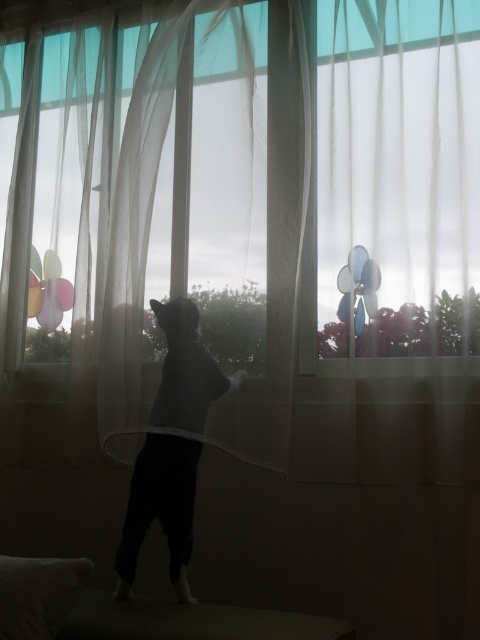
You are a small toy that is 10 cm tall. You are placed on the dark brown wooden stool at lower center and want to roll down to the floor. Will you pass by the silhouette fur at center on your way down?

The dark brown wooden stool at lower center is in front of the silhouette fur at center, meaning the silhouette fur at center is behind the stool. Since the toy is on the stool and rolls down, it will not pass by the silhouette fur at center as it goes to the floor.

You are a photographer setting up a camera in this scene. You want to focus on the point that is closer to the camera. Which point should you choose between point (189, 529) and point (31, 570)?

Point (31, 570) is closer to the camera than point (189, 529), so you should focus on point (31, 570).

You are a photographer trying to capture the silhouette fur at center and the white soft pillow at lower left in a single shot. Since the pillow is partially hidden, can you adjust your position to fully include both objects in the frame without moving them?

The white soft pillow at lower left is behind the silhouette fur at center, so moving your camera position slightly forward or adjusting the angle might allow you to capture both objects in the frame without moving them.